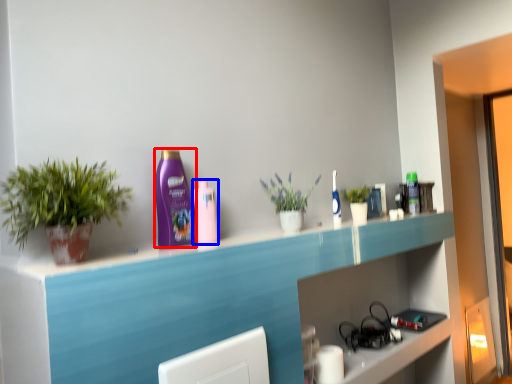
Question: Which object appears closest to the camera in this image, cleaning product (highlighted by a red box) or mouthwash (highlighted by a blue box)?

Choices:
 (A) cleaning product
 (B) mouthwash

Answer: (A)